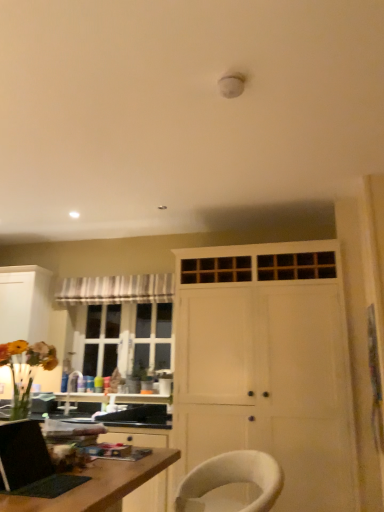
Question: Should I look upward or downward to see white matte cabinet at left, the first cabinetry when ordered from left to right?

Choices:
 (A) down
 (B) up

Answer: (A)

Question: Is matte black laptop at lower left outside white fabric chair at lower center?

Choices:
 (A) no
 (B) yes

Answer: (B)

Question: Considering the relative positions of matte black laptop at lower left and white fabric chair at lower center in the image provided, is matte black laptop at lower left to the right of white fabric chair at lower center from the viewer's perspective?

Choices:
 (A) no
 (B) yes

Answer: (A)

Question: Is white fabric chair at lower center a part of matte black laptop at lower left?

Choices:
 (A) yes
 (B) no

Answer: (B)

Question: Is matte black laptop at lower left far from white fabric chair at lower center?

Choices:
 (A) no
 (B) yes

Answer: (A)

Question: From the image's perspective, is matte black laptop at lower left under white fabric chair at lower center?

Choices:
 (A) no
 (B) yes

Answer: (A)

Question: Can you see matte black laptop at lower left touching white fabric chair at lower center?

Choices:
 (A) no
 (B) yes

Answer: (A)

Question: Is white fabric chair at lower center taller than striped fabric curtain at upper left?

Choices:
 (A) no
 (B) yes

Answer: (B)

Question: Is white fabric chair at lower center facing towards striped fabric curtain at upper left?

Choices:
 (A) no
 (B) yes

Answer: (A)

Question: Does white fabric chair at lower center touch striped fabric curtain at upper left?

Choices:
 (A) yes
 (B) no

Answer: (B)

Question: From a real-world perspective, does white fabric chair at lower center stand above striped fabric curtain at upper left?

Choices:
 (A) no
 (B) yes

Answer: (A)

Question: Considering the relative sizes of white fabric chair at lower center and striped fabric curtain at upper left in the image provided, is white fabric chair at lower center smaller than striped fabric curtain at upper left?

Choices:
 (A) no
 (B) yes

Answer: (A)

Question: Does white fabric chair at lower center have a lesser width compared to striped fabric curtain at upper left?

Choices:
 (A) no
 (B) yes

Answer: (A)

Question: Is wooden desk at lower left looking in the opposite direction of matte black laptop at lower left?

Choices:
 (A) yes
 (B) no

Answer: (B)